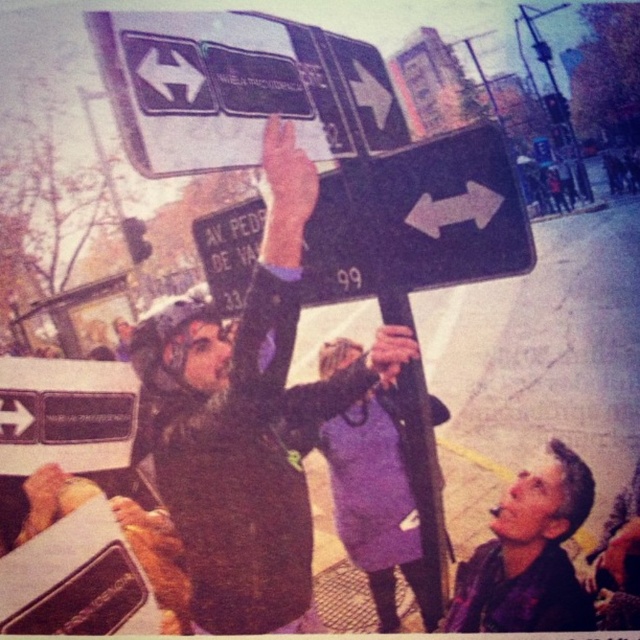
Who is positioned more to the right, dark brown fur coat at upper center or black matte sign at upper center?

From the viewer's perspective, black matte sign at upper center appears more on the right side.

Find the location of a particular element. This screenshot has height=640, width=640. dark brown fur coat at upper center is located at coordinates (246, 419).

You are a GUI agent. You are given a task and a screenshot of the screen. Output one action in this format:
    pyautogui.click(x=<x>, y=<y>)
    Task: Click on the dark brown fur coat at upper center
    This screenshot has width=640, height=640.
    Given the screenshot: What is the action you would take?
    pyautogui.click(x=246, y=419)

Who is more forward, (195, 362) or (579, 608)?

Point (579, 608)

Does dark brown fur coat at upper center have a lesser width compared to shiny purple jacket at lower right?

No, dark brown fur coat at upper center is not thinner than shiny purple jacket at lower right.

What are the coordinates of `dark brown fur coat at upper center` in the screenshot? It's located at point(246,419).

Measure the distance between black matte sign at upper center and purple fabric dress at center.

black matte sign at upper center is 55.40 centimeters from purple fabric dress at center.

Is black matte sign at upper center smaller than purple fabric dress at center?

Incorrect, black matte sign at upper center is not smaller in size than purple fabric dress at center.

This screenshot has height=640, width=640. What do you see at coordinates (417, 220) in the screenshot?
I see `black matte sign at upper center` at bounding box center [417, 220].

Image resolution: width=640 pixels, height=640 pixels. In order to click on black matte sign at upper center in this screenshot , I will do `click(417, 220)`.